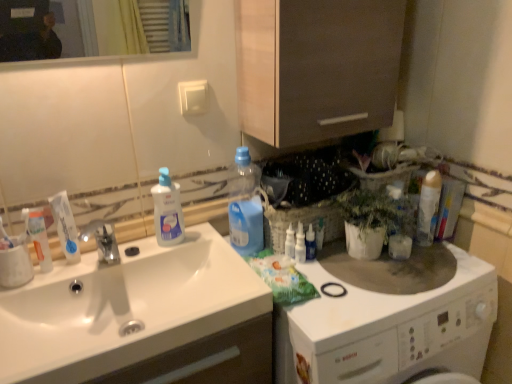
Image resolution: width=512 pixels, height=384 pixels. I want to click on free space in front of translucent plastic spray bottle at upper right, positioned as the third toiletry in left-to-right order, so (x=329, y=301).